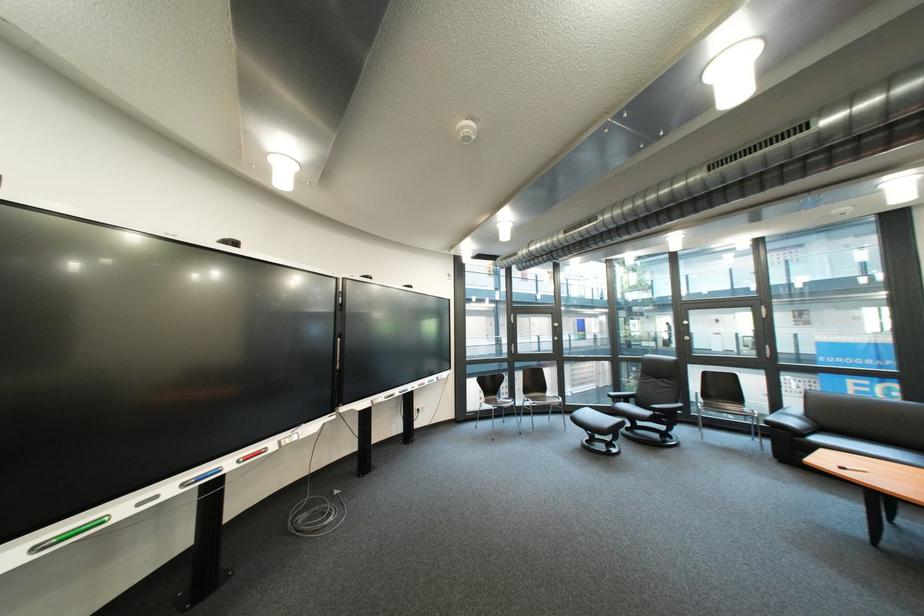
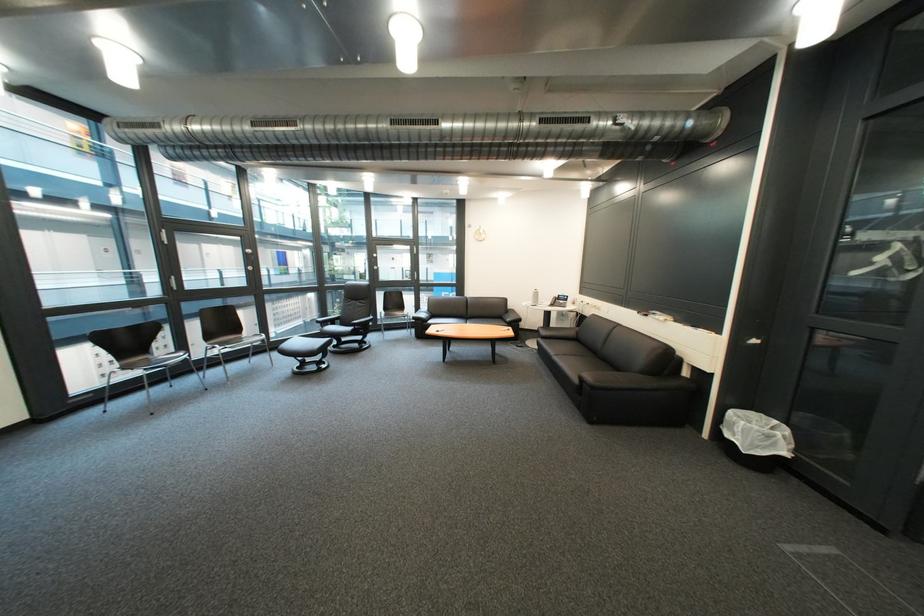
In the second image, find the point that corresponds to (x=542, y=400) in the first image.

(229, 347)